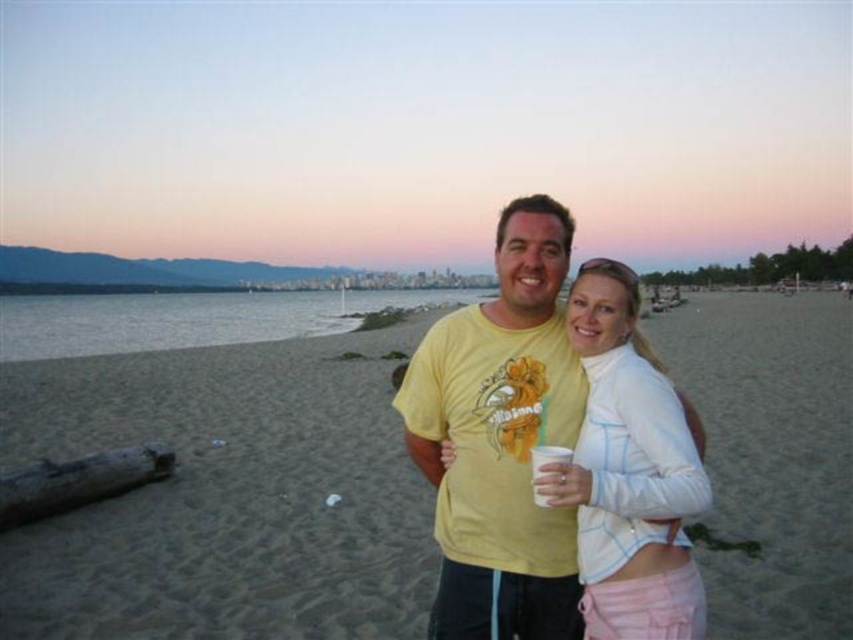
Is yellow cotton t-shirt at center below white matte jacket at center?

Indeed, yellow cotton t-shirt at center is positioned under white matte jacket at center.

Does yellow cotton t-shirt at center appear on the right side of white matte jacket at center?

Incorrect, yellow cotton t-shirt at center is not on the right side of white matte jacket at center.

The image size is (853, 640). What are the coordinates of `yellow cotton t-shirt at center` in the screenshot? It's located at (502, 438).

What are the coordinates of `yellow cotton t-shirt at center` in the screenshot? It's located at click(502, 438).

Is sandy beach at center smaller than white matte jacket at center?

No.

Is point (294, 524) positioned after point (659, 579)?

Yes, it is.

The height and width of the screenshot is (640, 853). What are the coordinates of `sandy beach at center` in the screenshot? It's located at (223, 497).

Is white matte jacket at center below white paper cup at center?

No.

Looking at this image, is white matte jacket at center to the right of white paper cup at center from the viewer's perspective?

Correct, you'll find white matte jacket at center to the right of white paper cup at center.

Does point (659, 428) come closer to viewer compared to point (537, 461)?

Yes.

Locate an element on the screen. The image size is (853, 640). white matte jacket at center is located at coordinates (630, 472).